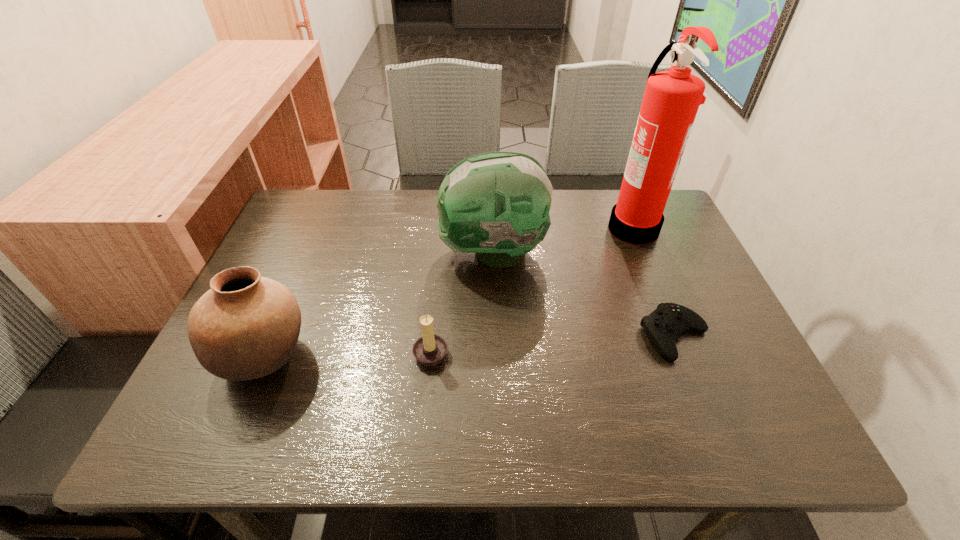
The image size is (960, 540). Identify the location of object that is at the far right corner. [671, 100].

The image size is (960, 540). Identify the location of free space at the far edge of the desktop. (584, 234).

The height and width of the screenshot is (540, 960). In the image, there is a desktop. In order to click on vacant space at the near edge in this screenshot , I will do `click(458, 418)`.

The image size is (960, 540). I want to click on free space at the left edge of the desktop, so click(x=233, y=382).

Find the location of a particular element. This screenshot has height=540, width=960. vacant space at the right edge of the desktop is located at coordinates (758, 375).

Where is `vacant space at the far left corner of the desktop`? Image resolution: width=960 pixels, height=540 pixels. vacant space at the far left corner of the desktop is located at coordinates (286, 233).

Locate an element on the screen. The image size is (960, 540). free space between the candle holder and the third tallest object is located at coordinates (348, 354).

The image size is (960, 540). In order to click on vacant space in between the third shortest object and the fire extinguisher in this screenshot , I will do `click(448, 292)`.

Identify the location of free space between the pottery and the tallest object. (448, 292).

Where is `vacant space in between the candle holder and the third tallest object`? vacant space in between the candle holder and the third tallest object is located at coordinates (348, 354).